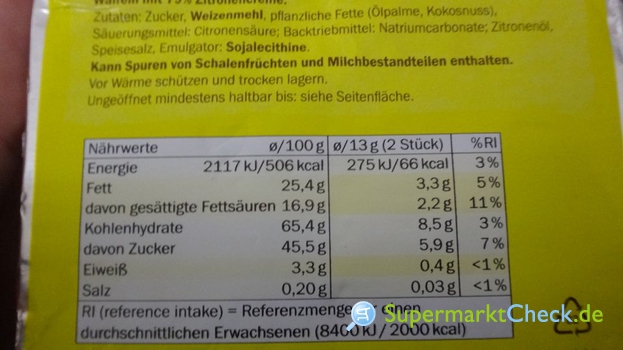
Where is `columns`? columns is located at coordinates (227, 143), (388, 142), (496, 142), (278, 308).